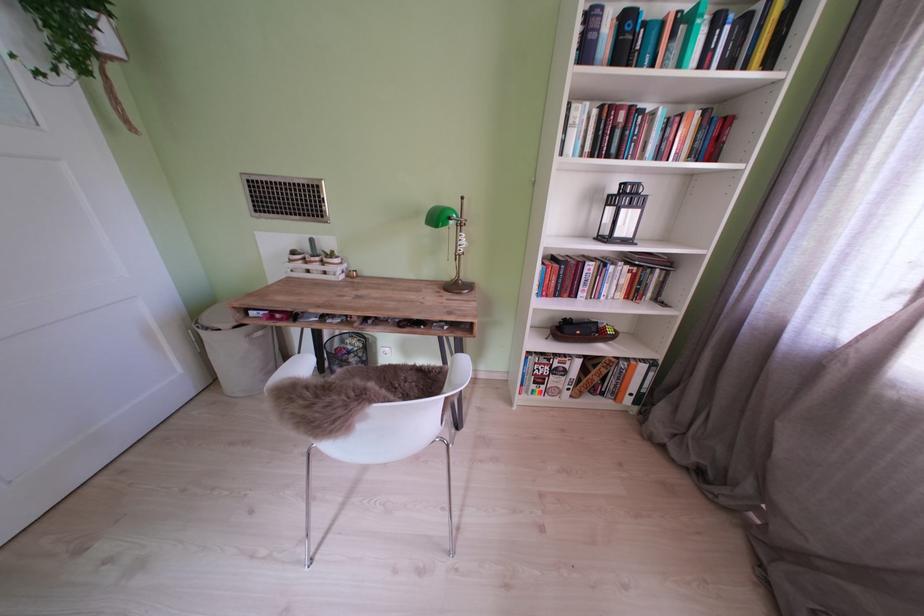
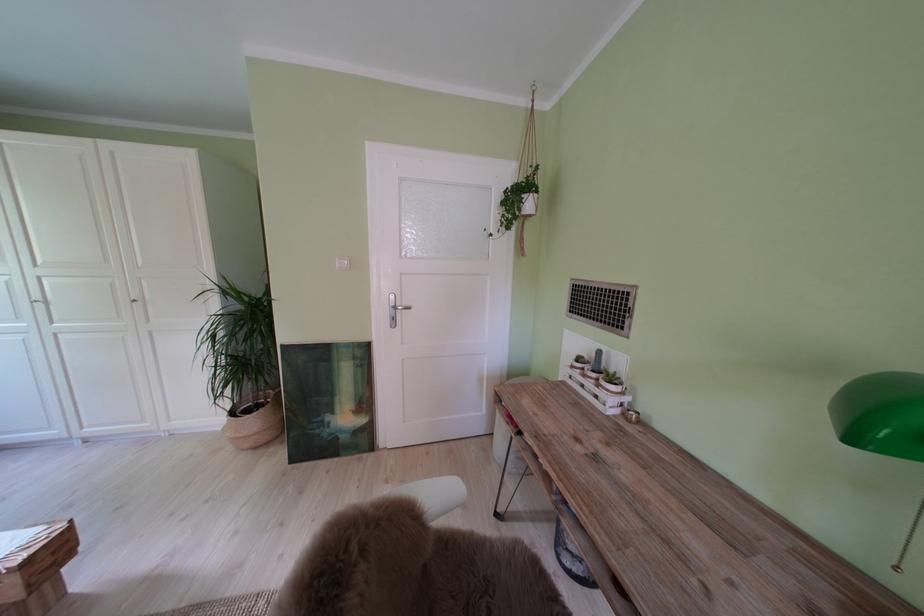
In the second image, find the point that corresponds to the point at 103,44 in the first image.

(530, 215)